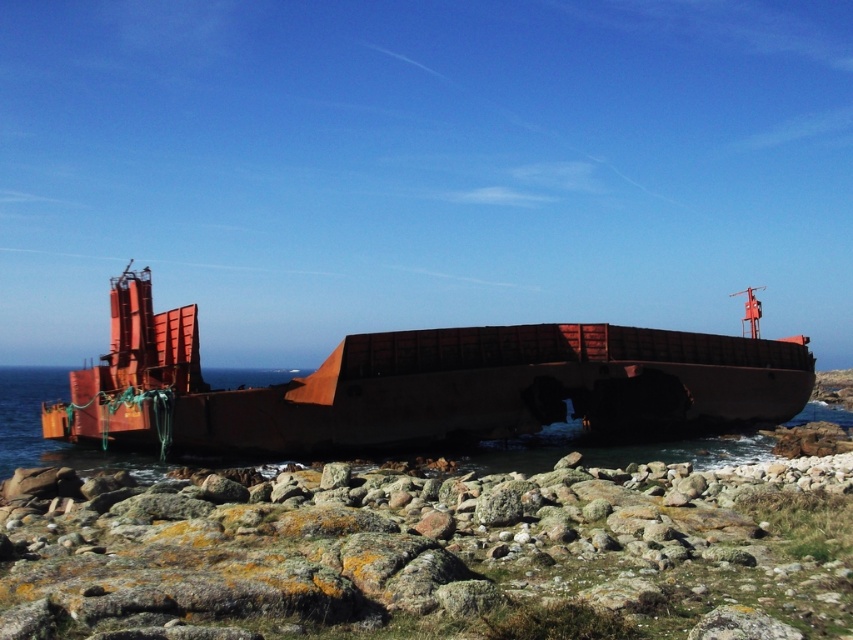
Who is more forward, (653,349) or (254,374)?

Point (653,349) is more forward.

Measure the distance between rusty metal boat at center and rusty metal water at center.

The distance of rusty metal boat at center from rusty metal water at center is 32.19 meters.

Image resolution: width=853 pixels, height=640 pixels. I want to click on rusty metal boat at center, so click(x=422, y=385).

This screenshot has height=640, width=853. In order to click on rusty metal boat at center in this screenshot , I will do `click(422, 385)`.